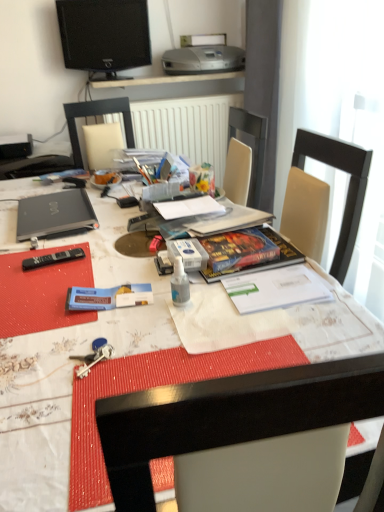
What are the coordinates of `unoccupied region to the right of black plastic remote control at lower left` in the screenshot? It's located at (109, 258).